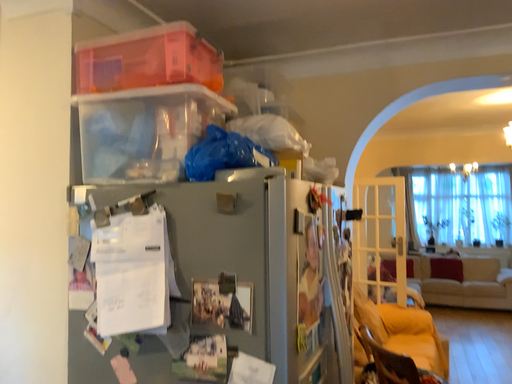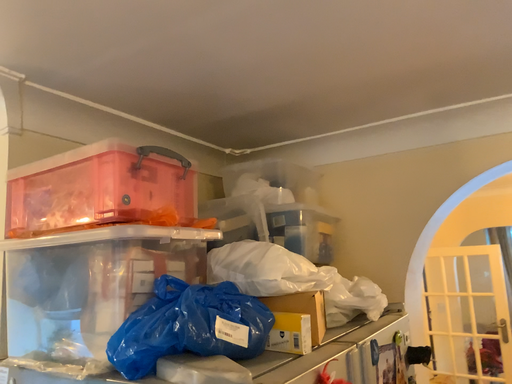
Question: How did the camera likely rotate when shooting the video?

Choices:
 (A) rotated left
 (B) rotated right

Answer: (A)